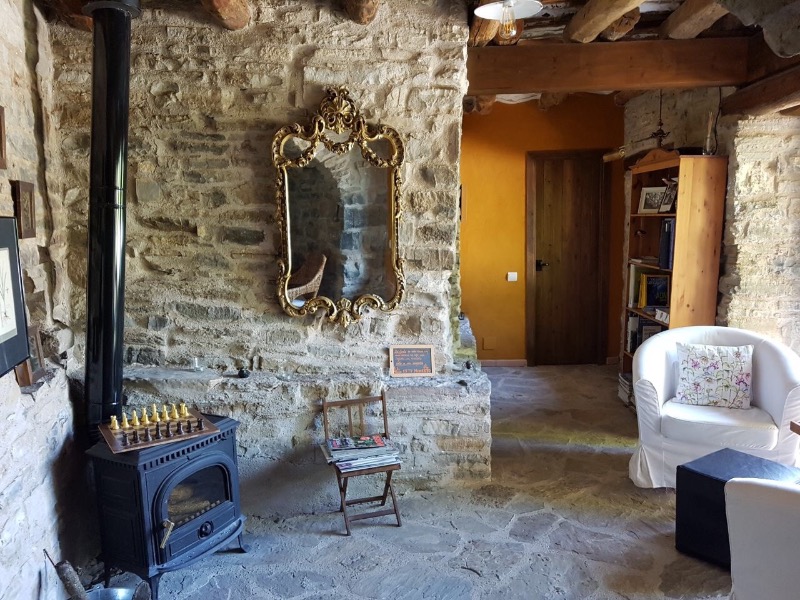
Where is `wooden bookcase`? The height and width of the screenshot is (600, 800). wooden bookcase is located at coordinates (694, 213).